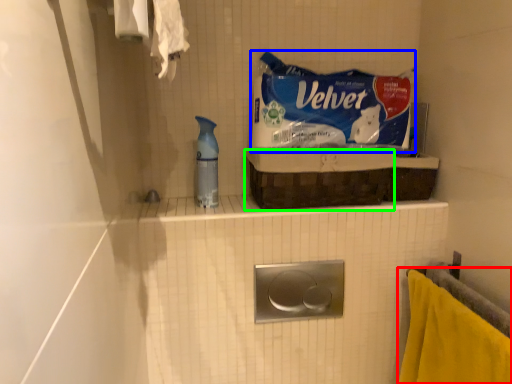
Question: Which object is positioned closest to towel (highlighted by a red box)? Select from product (highlighted by a blue box) and basket (highlighted by a green box).

Choices:
 (A) product
 (B) basket

Answer: (B)